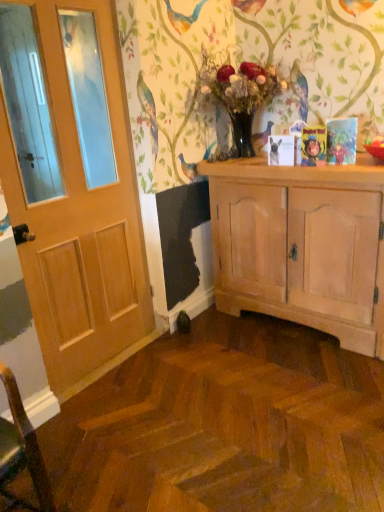
Question: Is matte white dog at center at the left side of cartoon character book at upper right?

Choices:
 (A) yes
 (B) no

Answer: (A)

Question: Is matte white dog at center not near cartoon character book at upper right?

Choices:
 (A) no
 (B) yes

Answer: (A)

Question: Is matte white dog at center further to the viewer compared to cartoon character book at upper right?

Choices:
 (A) yes
 (B) no

Answer: (A)

Question: Does matte white dog at center have a lesser height compared to cartoon character book at upper right?

Choices:
 (A) no
 (B) yes

Answer: (B)

Question: Does matte white dog at center lie in front of cartoon character book at upper right?

Choices:
 (A) no
 (B) yes

Answer: (A)

Question: From a real-world perspective, is light wood cabinet at center physically located above or below translucent glass vase at center?

Choices:
 (A) below
 (B) above

Answer: (A)

Question: Is light wood cabinet at center wider or thinner than translucent glass vase at center?

Choices:
 (A) wide
 (B) thin

Answer: (A)

Question: In the image, is light wood cabinet at center on the left side or the right side of translucent glass vase at center?

Choices:
 (A) left
 (B) right

Answer: (B)

Question: From the image's perspective, is light wood cabinet at center located above or below translucent glass vase at center?

Choices:
 (A) below
 (B) above

Answer: (A)

Question: Do you think cartoon character book at upper right is within wooden door at left, or outside of it?

Choices:
 (A) inside
 (B) outside

Answer: (B)

Question: From the image's perspective, is cartoon character book at upper right positioned above or below wooden door at left?

Choices:
 (A) above
 (B) below

Answer: (A)

Question: From a real-world perspective, relative to wooden door at left, is cartoon character book at upper right vertically above or below?

Choices:
 (A) below
 (B) above

Answer: (B)

Question: Considering the positions of point (309, 128) and point (62, 334), is point (309, 128) closer or farther from the camera than point (62, 334)?

Choices:
 (A) closer
 (B) farther

Answer: (B)

Question: In terms of height, does translucent glass vase at center look taller or shorter compared to matte white dog at center?

Choices:
 (A) short
 (B) tall

Answer: (B)

Question: In the image, is translucent glass vase at center on the left side or the right side of matte white dog at center?

Choices:
 (A) left
 (B) right

Answer: (A)